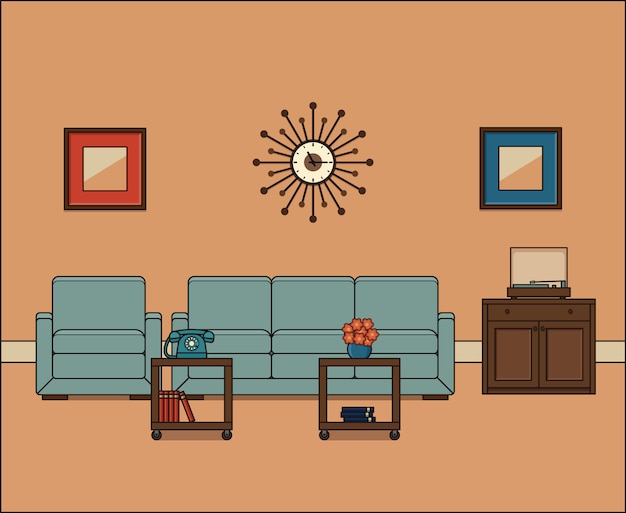
Locate an element on the screen. Image resolution: width=626 pixels, height=513 pixels. wall clock is located at coordinates (313, 173).